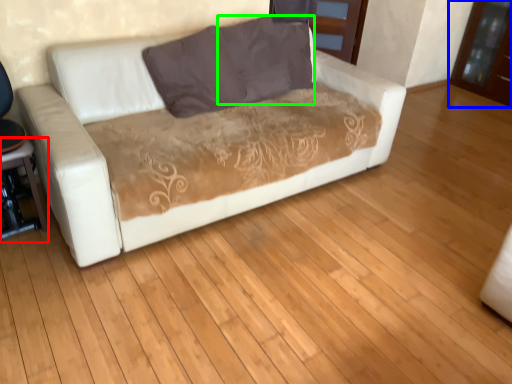
Question: Which object is the farthest from table (highlighted by a red box)? Choose among these: dresser (highlighted by a blue box) or pillow (highlighted by a green box).

Choices:
 (A) dresser
 (B) pillow

Answer: (A)